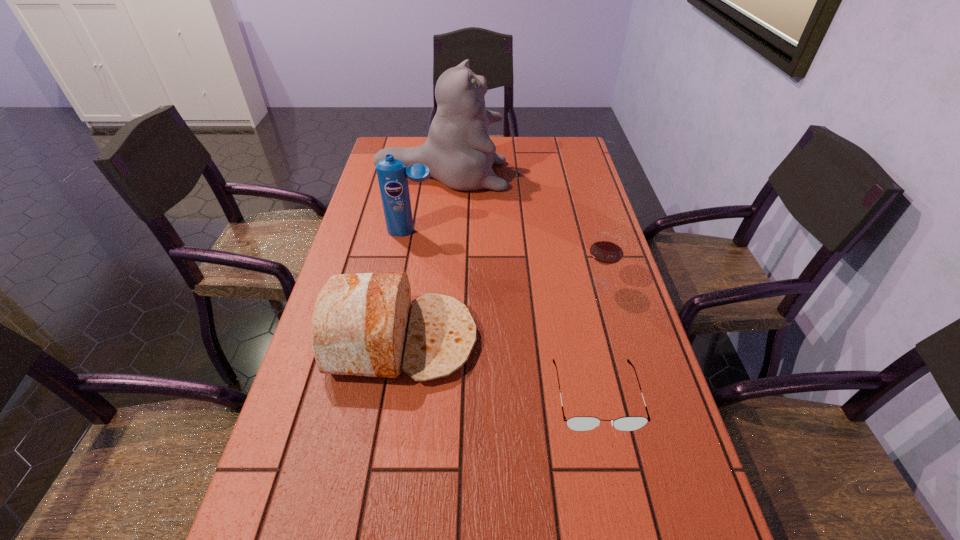
Point out which object is positioned as the second nearest to the shortest object. Please provide its 2D coordinates. Your answer should be formatted as a tuple, i.e. [(x, y)], where the tuple contains the x and y coordinates of a point satisfying the conditions above.

[(607, 248)]

The height and width of the screenshot is (540, 960). In order to click on vacant region that satisfies the following two spatial constraints: 1. on the front side of the fourth nearest object; 2. on the right side of the wineglass in this screenshot , I will do `click(401, 285)`.

Identify the location of free spot that satisfies the following two spatial constraints: 1. on the face of the cat; 2. on the back side of the third farthest object. This screenshot has height=540, width=960. (428, 285).

At what (x,y) coordinates should I click in order to perform the action: click on free space that satisfies the following two spatial constraints: 1. on the face of the cat; 2. on the right side of the wineglass. Please return your answer as a coordinate pair (x, y). The image size is (960, 540). Looking at the image, I should click on (428, 285).